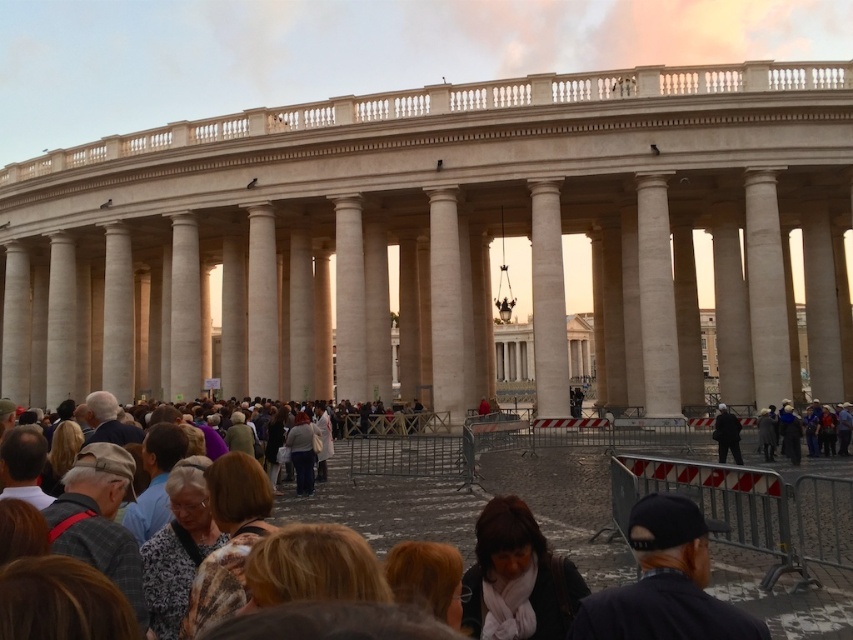
Question: Which point is closer to the camera?

Choices:
 (A) fluffy brown coat at center
 (B) patterned fabric headscarf at center

Answer: (A)

Question: Can you confirm if blonde hair at center is positioned below blonde hair at lower center?

Choices:
 (A) no
 (B) yes

Answer: (A)

Question: Which is farther from the blonde hair at center?

Choices:
 (A) fluffy brown coat at center
 (B) light brown leather jacket at center
 (C) blonde hair at lower center
 (D) patterned fabric headscarf at center

Answer: (B)

Question: Is fluffy brown coat at center to the right of light brown leather jacket at center from the viewer's perspective?

Choices:
 (A) no
 (B) yes

Answer: (A)

Question: Which object is farther from the camera taking this photo?

Choices:
 (A) metallic silver barrier at lower right
 (B) blonde hair at center
 (C) white scarf at center
 (D) light brown leather jacket at center

Answer: (D)

Question: Is metallic silver barrier at lower right thinner than blonde hair at center?

Choices:
 (A) no
 (B) yes

Answer: (A)